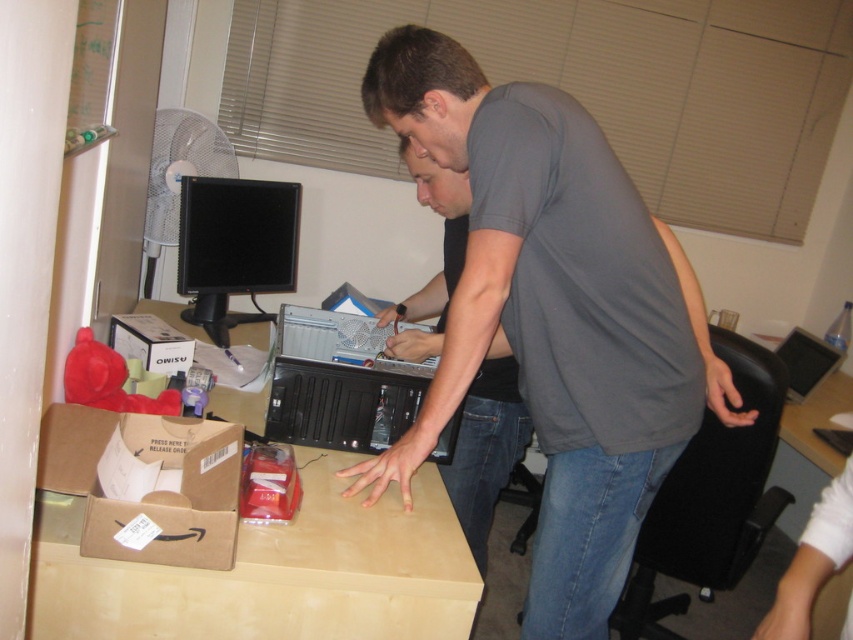
Is gray matte shirt at center thinner than gray cotton shirt at center?

In fact, gray matte shirt at center might be wider than gray cotton shirt at center.

Can you confirm if gray matte shirt at center is positioned to the left of gray cotton shirt at center?

Incorrect, gray matte shirt at center is not on the left side of gray cotton shirt at center.

Find the location of a particular element. This screenshot has width=853, height=640. gray matte shirt at center is located at coordinates (554, 316).

You are a GUI agent. You are given a task and a screenshot of the screen. Output one action in this format:
    pyautogui.click(x=<x>, y=<y>)
    Task: Click on the gray matte shirt at center
    The image size is (853, 640).
    Given the screenshot: What is the action you would take?
    pyautogui.click(x=554, y=316)

Is black plastic desktop computer at center further to the viewer compared to gray cotton shirt at center?

Yes, it is.

Can you confirm if black plastic desktop computer at center is positioned to the right of gray cotton shirt at center?

No, black plastic desktop computer at center is not to the right of gray cotton shirt at center.

Between point (379, 429) and point (500, 349), which one is positioned behind?

The point (500, 349) is more distant.

At what (x,y) coordinates should I click in order to perform the action: click on black plastic desktop computer at center. Please return your answer as a coordinate pair (x, y). This screenshot has width=853, height=640. Looking at the image, I should click on [x=339, y=384].

Can you confirm if brown cardboard computer desk at center is thinner than black plastic desktop computer at center?

Incorrect, brown cardboard computer desk at center's width is not less than black plastic desktop computer at center's.

Which of these two, brown cardboard computer desk at center or black plastic desktop computer at center, stands shorter?

Standing shorter between the two is black plastic desktop computer at center.

Which is behind, point (433, 468) or point (346, 428)?

The point (433, 468) is more distant.

Where is `brown cardboard computer desk at center`? brown cardboard computer desk at center is located at coordinates (242, 556).